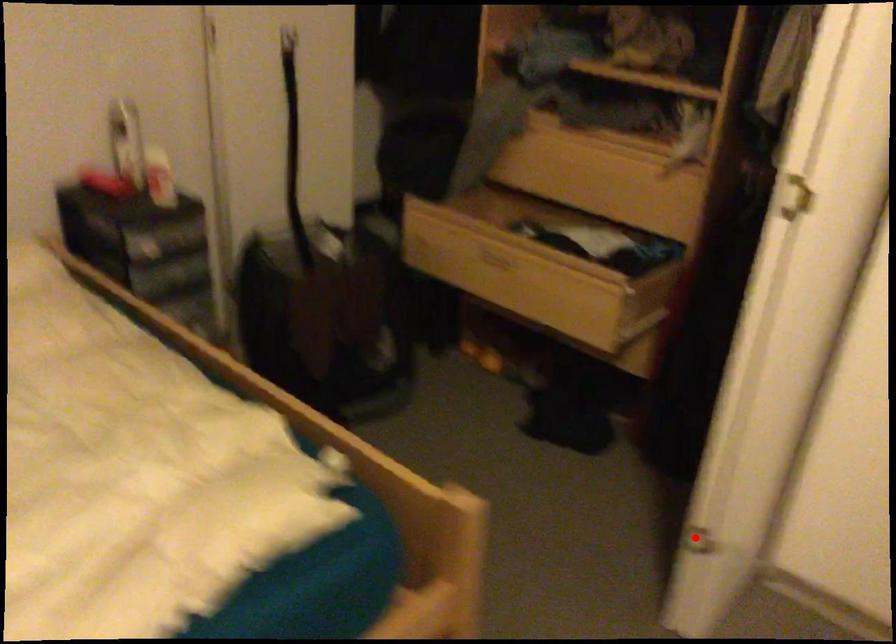
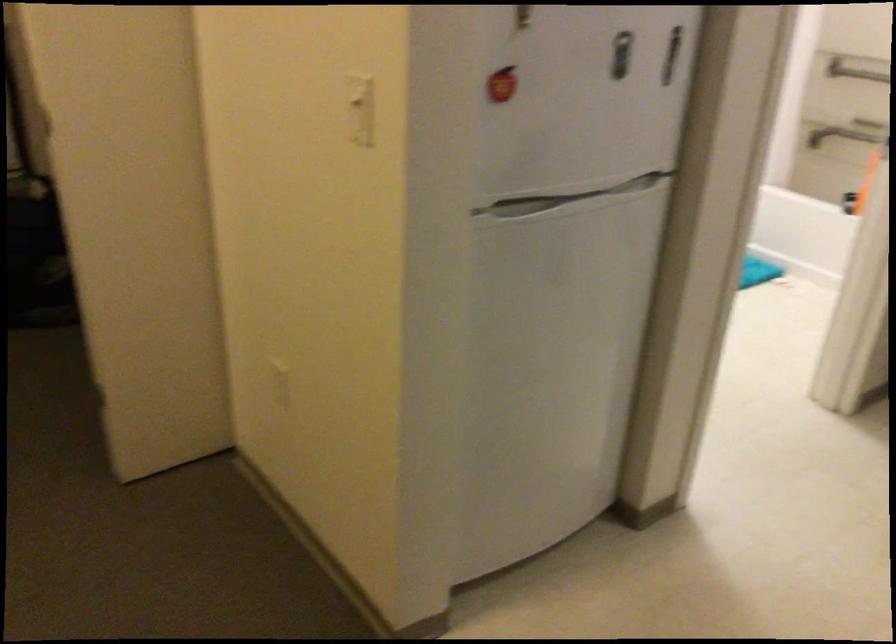
Question: I am providing you with two images of the same scene from different viewpoints. A red point is marked on the first image. Is the red point's position out of view in image 2?

Choices:
 (A) Yes
 (B) No

Answer: (A)